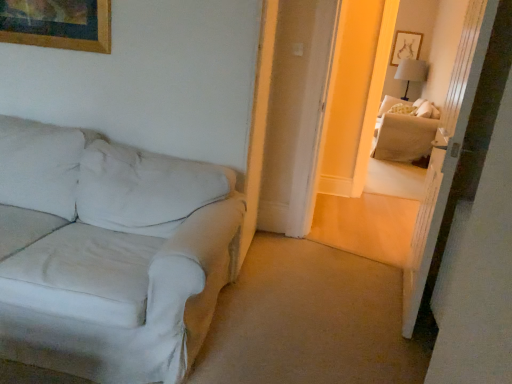
Question: Would you say beige fabric couch at right contains transparent glass door at upper right?

Choices:
 (A) no
 (B) yes

Answer: (A)

Question: Is transparent glass door at upper right at the back of beige fabric couch at right?

Choices:
 (A) no
 (B) yes

Answer: (A)

Question: Does beige fabric couch at right have a smaller size compared to transparent glass door at upper right?

Choices:
 (A) no
 (B) yes

Answer: (A)

Question: Does beige fabric couch at right come behind transparent glass door at upper right?

Choices:
 (A) no
 (B) yes

Answer: (B)

Question: From a real-world perspective, is beige fabric couch at right on transparent glass door at upper right?

Choices:
 (A) yes
 (B) no

Answer: (B)

Question: Considering the positions of beige fabric couch at right and white fabric couch at left in the image, is beige fabric couch at right taller or shorter than white fabric couch at left?

Choices:
 (A) tall
 (B) short

Answer: (A)

Question: Which is correct: beige fabric couch at right is inside white fabric couch at left, or outside of it?

Choices:
 (A) outside
 (B) inside

Answer: (A)

Question: Would you say beige fabric couch at right is to the left or to the right of white fabric couch at left in the picture?

Choices:
 (A) right
 (B) left

Answer: (A)

Question: Looking at their shapes, would you say beige fabric couch at right is wider or thinner than white fabric couch at left?

Choices:
 (A) thin
 (B) wide

Answer: (A)

Question: From their relative heights in the image, would you say white fabric couch at left is taller or shorter than beige fabric couch at right?

Choices:
 (A) tall
 (B) short

Answer: (B)

Question: Relative to beige fabric couch at right, is white fabric couch at left in front or behind?

Choices:
 (A) behind
 (B) front

Answer: (B)

Question: Considering the positions of point (169, 352) and point (409, 155), is point (169, 352) closer or farther from the camera than point (409, 155)?

Choices:
 (A) farther
 (B) closer

Answer: (B)

Question: In terms of width, does white fabric couch at left look wider or thinner when compared to beige fabric couch at right?

Choices:
 (A) thin
 (B) wide

Answer: (B)

Question: From a real-world perspective, is gray fabric table lamp at upper right above or below transparent glass door at upper right?

Choices:
 (A) above
 (B) below

Answer: (A)

Question: In terms of width, does gray fabric table lamp at upper right look wider or thinner when compared to transparent glass door at upper right?

Choices:
 (A) thin
 (B) wide

Answer: (B)